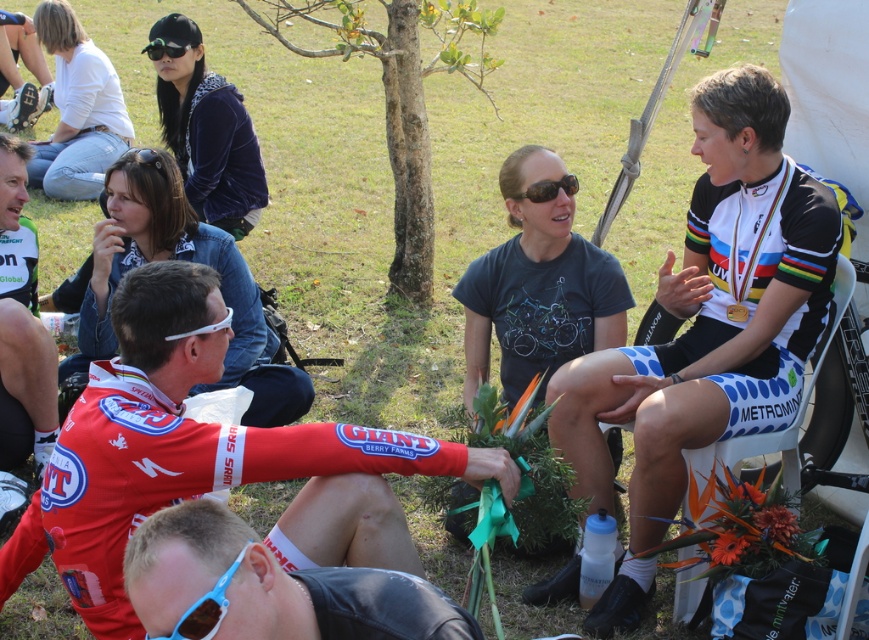
You are a photographer at the event and want to take a photo focusing on the blue plastic sunglasses at lower left and the black matte goggles at upper center. Which object should you adjust your camera focus on first if you want to ensure both are in focus?

The blue plastic sunglasses at lower left is closer to the viewer than the black matte goggles at upper center. To ensure both are in focus, you should adjust your camera focus on the closer object first, which is the blue plastic sunglasses at lower left.

You are a photographer standing at the edge of the gathering area. You want to take a photo that includes both the blue plastic sunglasses at lower left and the black matte goggles at upper center. What is the minimum distance you need to move backward to ensure both objects are in frame?

The blue plastic sunglasses at lower left is 3.72 meters from the black matte goggles at upper center. To include both in the frame, you need to move backward until you can cover this distance within your camera lens field of view. The exact distance depends on your lens focal length and sensor size, but knowing the 3.72 meters separation helps in calculating the required adjustment.

You are planning to wear either the blue plastic sunglasses at lower left or the black matte goggles at upper center for a cycling event. Based on their sizes, which one might be more comfortable for you if you prefer a narrower frame?

The blue plastic sunglasses at lower left has a lesser width compared to the black matte goggles at upper center, so it would be more comfortable if you prefer a narrower frame.